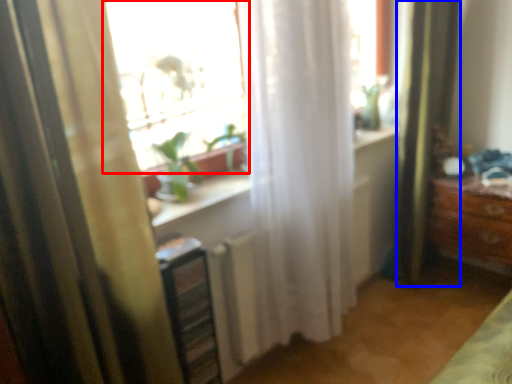
Question: Which point is further to the camera, window (highlighted by a red box) or shower curtain (highlighted by a blue box)?

Choices:
 (A) window
 (B) shower curtain

Answer: (B)